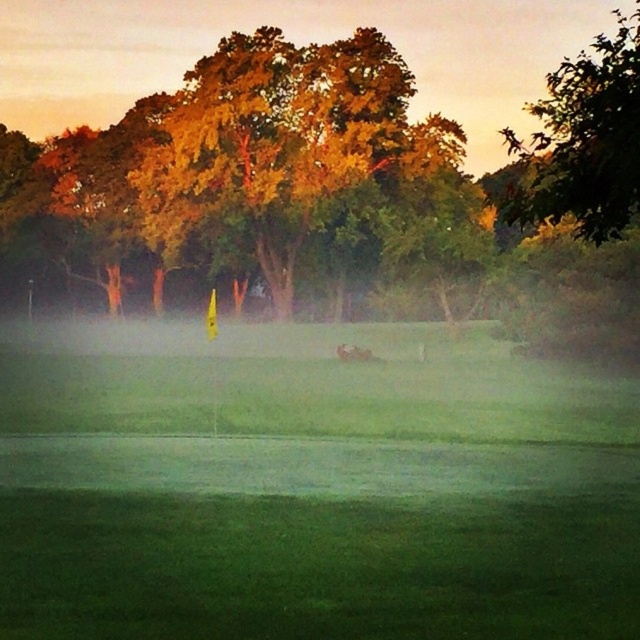
Question: Which object is the farthest from the green grassy field at center?

Choices:
 (A) brown fuzzy dog at center
 (B) green leafy tree at upper right

Answer: (B)

Question: Observing the image, what is the correct spatial positioning of golden leafy tree at upper center in reference to brown fuzzy dog at center?

Choices:
 (A) left
 (B) right

Answer: (A)

Question: Does green grassy field at center appear under green leafy tree at upper right?

Choices:
 (A) no
 (B) yes

Answer: (B)

Question: Considering the real-world distances, which object is closest to the brown fuzzy dog at center?

Choices:
 (A) golden leafy tree at upper center
 (B) green leafy tree at upper right
 (C) green grassy field at center
 (D) golden leafy tree at center

Answer: (C)

Question: Is golden leafy tree at upper center to the left of brown fuzzy dog at center from the viewer's perspective?

Choices:
 (A) yes
 (B) no

Answer: (A)

Question: Which of these objects is positioned farthest from the green grassy field at center?

Choices:
 (A) golden leafy tree at upper center
 (B) golden leafy tree at center

Answer: (B)